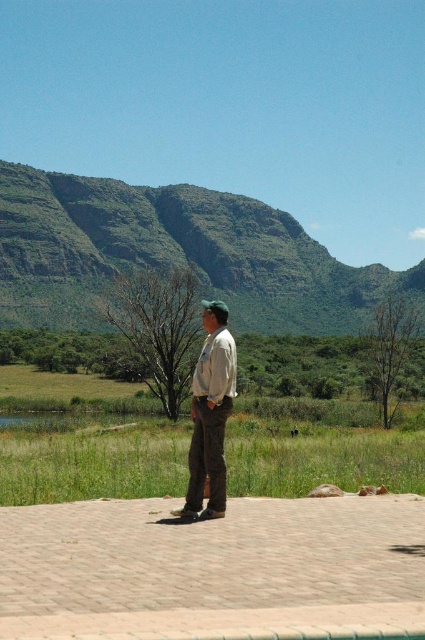
Question: Is green grass at center thinner than khaki pants at center?

Choices:
 (A) no
 (B) yes

Answer: (A)

Question: Does green rocky mountain at upper center have a greater width compared to khaki pants at center?

Choices:
 (A) yes
 (B) no

Answer: (A)

Question: Which is nearer to the green grass at center?

Choices:
 (A) khaki pants at center
 (B) green rocky mountain at upper center

Answer: (A)

Question: Which is nearer to the green grass at center?

Choices:
 (A) khaki pants at center
 (B) green rocky mountain at upper center

Answer: (A)

Question: Is green grass at center above khaki pants at center?

Choices:
 (A) no
 (B) yes

Answer: (A)

Question: Considering the real-world distances, which object is farthest from the green grass at center?

Choices:
 (A) khaki pants at center
 (B) green rocky mountain at upper center

Answer: (B)